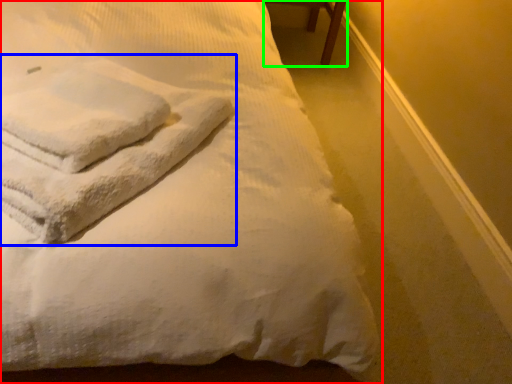
Question: Which object is positioned closest to bed (highlighted by a red box)? Select from bath towel (highlighted by a blue box) and furniture (highlighted by a green box).

Choices:
 (A) bath towel
 (B) furniture

Answer: (A)